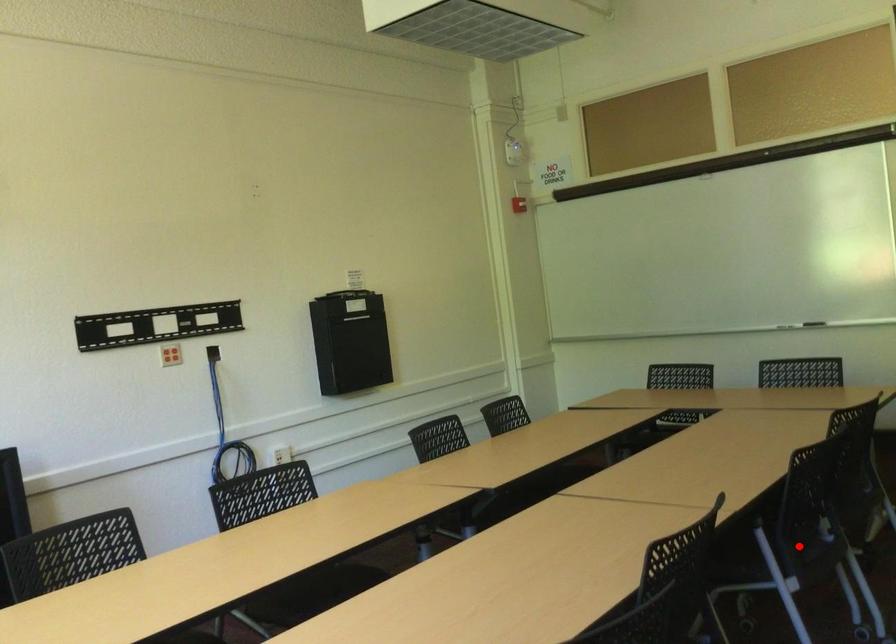
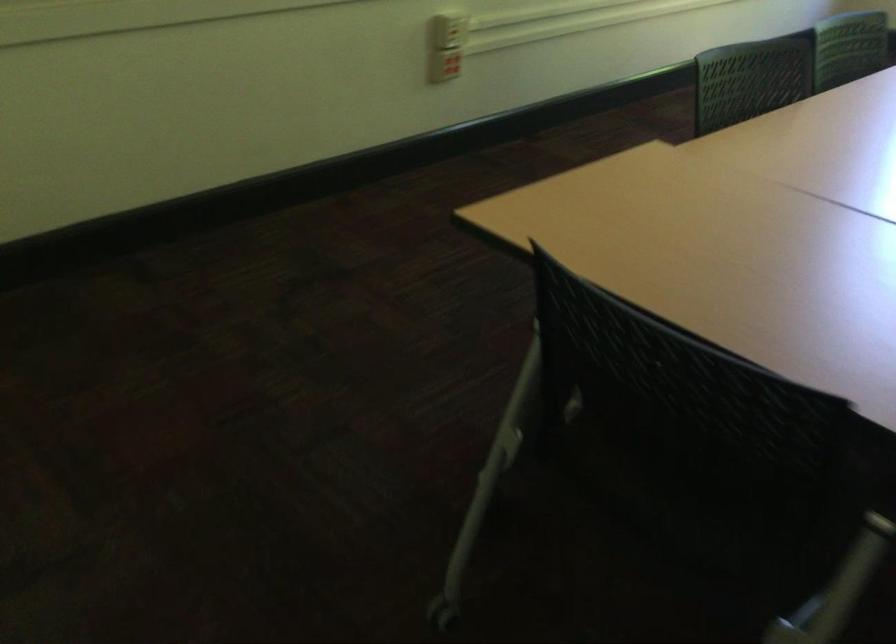
Question: I am providing you with two images of the same scene from different viewpoints. A red point is marked on the first image. Can you still see the location of the red point in image 2?

Choices:
 (A) Yes
 (B) No

Answer: (B)